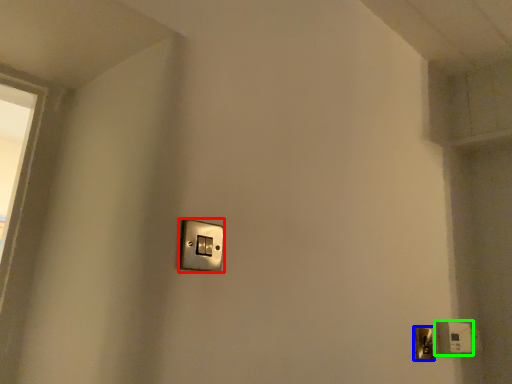
Question: Which is nearer to the light switch (highlighted by a red box)? door handle (highlighted by a blue box) or light switch (highlighted by a green box).

Choices:
 (A) door handle
 (B) light switch

Answer: (A)